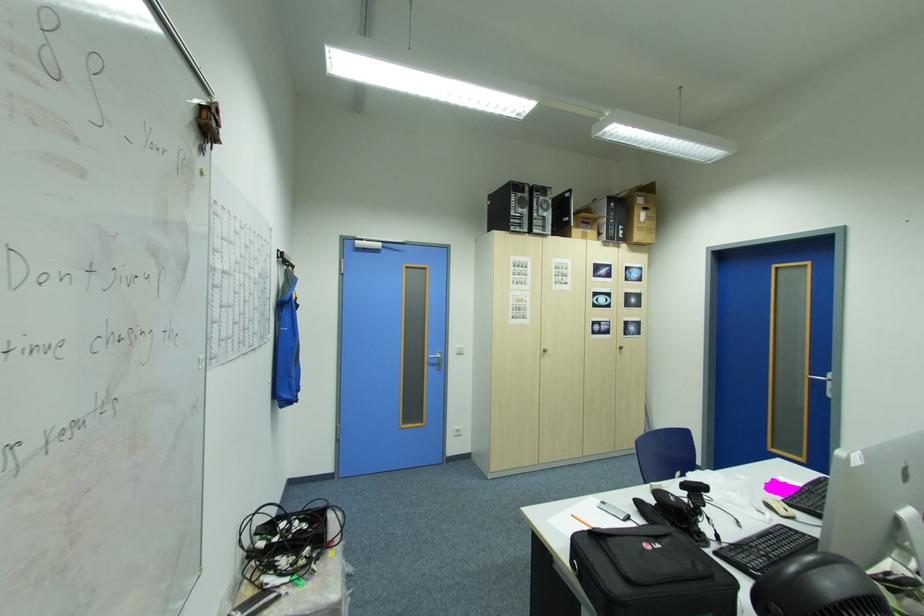
What do you see at coordinates (664, 454) in the screenshot? The width and height of the screenshot is (924, 616). I see `a blue chair sitting surface` at bounding box center [664, 454].